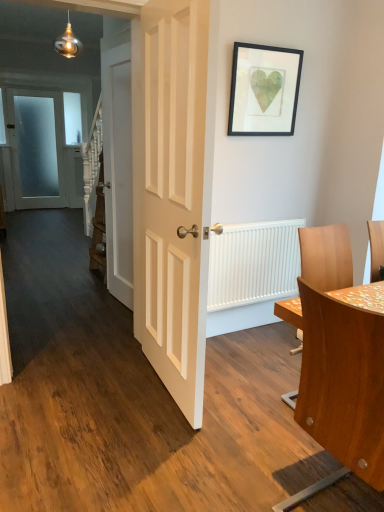
What is the approximate width of black matte picture frame at upper center?

black matte picture frame at upper center is 2.11 inches in width.

The image size is (384, 512). Find the location of `wooden table at right`. wooden table at right is located at coordinates 343,382.

What do you see at coordinates (253, 263) in the screenshot?
I see `white ribbed radiator at right` at bounding box center [253, 263].

Image resolution: width=384 pixels, height=512 pixels. Identify the location of white ribbed radiator at right. (253, 263).

What do you see at coordinates (172, 190) in the screenshot? I see `white glossy door at center, which appears as the 1th door when viewed from the right` at bounding box center [172, 190].

Identify the location of black matte picture frame at upper center. (264, 90).

Is white ribbed radiator at right far away from white glossy door at center, which appears as the 1th door when viewed from the right?

white ribbed radiator at right is near white glossy door at center, which appears as the 1th door when viewed from the right, not far away.

Considering the relative positions of white ribbed radiator at right and white glossy door at center, the third door from the back, in the image provided, is white ribbed radiator at right behind white glossy door at center, the third door from the back,?

Yes, white ribbed radiator at right is further from the camera.

Is point (240, 263) positioned before point (199, 130)?

No, it is not.

At what (x,y) coordinates should I click in order to perform the action: click on door that is the 1st one when counting upward from the white ribbed radiator at right (from the image's perspective). Please return your answer as a coordinate pair (x, y). Looking at the image, I should click on (172, 190).

Is white glossy door at center, the first door when ordered from front to back, to the left of white ribbed radiator at right from the viewer's perspective?

Indeed, white glossy door at center, the first door when ordered from front to back, is positioned on the left side of white ribbed radiator at right.

From the image's perspective, is white glossy door at center, the third door from the back, above or below white ribbed radiator at right?

From the image's perspective, white glossy door at center, the third door from the back, appears above white ribbed radiator at right.

This screenshot has height=512, width=384. Find the location of `radiator directly beneath the white glossy door at center, which appears as the 1th door when viewed from the right (from a real-world perspective)`. radiator directly beneath the white glossy door at center, which appears as the 1th door when viewed from the right (from a real-world perspective) is located at coordinates (253, 263).

Does point (31, 165) come behind point (111, 194)?

Yes, point (31, 165) is farther from viewer.

Who is bigger, frosted glass door at left, marked as the third door in a front-to-back arrangement, or white wooden door at center, which is the second door from front to back?

white wooden door at center, which is the second door from front to back.

Who is bigger, white wooden door at center, which is the second door from front to back, or white ribbed radiator at right?

Result: With larger size is white wooden door at center, which is the second door from front to back.

From the picture: Are white wooden door at center, acting as the 2th door starting from the left, and white ribbed radiator at right far apart?

No, white wooden door at center, acting as the 2th door starting from the left, is in close proximity to white ribbed radiator at right.

Is white wooden door at center, acting as the second door starting from the back, facing towards white ribbed radiator at right?

No, white wooden door at center, acting as the second door starting from the back, is not turned towards white ribbed radiator at right.

Considering the positions of point (106, 116) and point (243, 245), is point (106, 116) closer or farther from the camera than point (243, 245)?

Point (106, 116).

In terms of width, does white glossy door at center, the first door when ordered from front to back, look wider or thinner when compared to frosted glass door at left, the 1th door viewed from the left?

white glossy door at center, the first door when ordered from front to back, is wider than frosted glass door at left, the 1th door viewed from the left.

Is white glossy door at center, which appears as the 1th door when viewed from the right, positioned behind frosted glass door at left, the 1th door viewed from the left?

No, it is not.

Looking at this image, could frosted glass door at left, the 3th door in the right-to-left sequence, be considered to be inside white glossy door at center, which appears as the 1th door when viewed from the right?

No, frosted glass door at left, the 3th door in the right-to-left sequence, is not surrounded by white glossy door at center, which appears as the 1th door when viewed from the right.

Considering the positions of point (154, 358) and point (42, 105), is point (154, 358) closer or farther from the camera than point (42, 105)?

Point (154, 358) appears to be closer to the viewer than point (42, 105).

From a real-world perspective, is white ribbed radiator at right below black matte picture frame at upper center?

Yes, from a real-world perspective, white ribbed radiator at right is under black matte picture frame at upper center.

Looking at this image, considering the positions of objects white ribbed radiator at right and black matte picture frame at upper center in the image provided, who is more to the right, white ribbed radiator at right or black matte picture frame at upper center?

From the viewer's perspective, white ribbed radiator at right appears more on the right side.

Is white ribbed radiator at right aimed at black matte picture frame at upper center?

No, white ribbed radiator at right is not oriented towards black matte picture frame at upper center.

Considering the relative sizes of white ribbed radiator at right and black matte picture frame at upper center in the image provided, is white ribbed radiator at right shorter than black matte picture frame at upper center?

No, white ribbed radiator at right is not shorter than black matte picture frame at upper center.

Which object is closer to the camera taking this photo, black matte picture frame at upper center or white glossy door at center, which appears as the 1th door when viewed from the right?

white glossy door at center, which appears as the 1th door when viewed from the right, is in front.

Is black matte picture frame at upper center smaller than white glossy door at center, the third door from the back?

Indeed, black matte picture frame at upper center has a smaller size compared to white glossy door at center, the third door from the back.

From the image's perspective, which one is positioned higher, black matte picture frame at upper center or white glossy door at center, the first door when ordered from front to back?

black matte picture frame at upper center is shown above in the image.

Where is `the 1st door above the white ribbed radiator at right (from the image's perspective)`? The height and width of the screenshot is (512, 384). the 1st door above the white ribbed radiator at right (from the image's perspective) is located at coordinates (172, 190).

Where is `radiator located on the right of white glossy door at center, which appears as the 1th door when viewed from the right`? radiator located on the right of white glossy door at center, which appears as the 1th door when viewed from the right is located at coordinates (253, 263).

In the scene shown: Looking at the image, which one is located closer to black matte picture frame at upper center, frosted glass door at left, marked as the third door in a front-to-back arrangement, or white wooden door at center, which is the second door from front to back?

white wooden door at center, which is the second door from front to back, is positioned closer to the anchor black matte picture frame at upper center.

Based on their spatial positions, is white glossy door at center, the first door when ordered from front to back, or black matte picture frame at upper center closer to white wooden door at center, arranged as the 2th door when viewed from the right?

Based on the image, white glossy door at center, the first door when ordered from front to back, appears to be nearer to white wooden door at center, arranged as the 2th door when viewed from the right.

Considering their positions, is wooden table at right positioned closer to white wooden door at center, acting as the 2th door starting from the left, than white ribbed radiator at right?

white ribbed radiator at right is closer to white wooden door at center, acting as the 2th door starting from the left.

Considering their positions, is frosted glass door at left, the 1th door viewed from the left, positioned closer to white glossy door at center, the third door from the back, than white ribbed radiator at right?

white ribbed radiator at right is closer to white glossy door at center, the third door from the back.

Estimate the real-world distances between objects in this image. Which object is closer to frosted glass door at left, the 3th door in the right-to-left sequence, white wooden door at center, acting as the second door starting from the back, or white glossy door at center, the first door when ordered from front to back?

The object closer to frosted glass door at left, the 3th door in the right-to-left sequence, is white wooden door at center, acting as the second door starting from the back.

Looking at the image, which one is located closer to white glossy door at center, the first door when ordered from front to back, frosted glass door at left, marked as the third door in a front-to-back arrangement, or black matte picture frame at upper center?

black matte picture frame at upper center lies closer to white glossy door at center, the first door when ordered from front to back, than the other object.

When comparing their distances from black matte picture frame at upper center, does wooden table at right or white ribbed radiator at right seem further?

wooden table at right is further to black matte picture frame at upper center.

Looking at this image, when comparing their distances from white glossy door at center, which appears as the 1th door when viewed from the right, does white ribbed radiator at right or white wooden door at center, acting as the 2th door starting from the left, seem further?

white ribbed radiator at right.

Locate an element on the screen. The width and height of the screenshot is (384, 512). radiator between black matte picture frame at upper center and frosted glass door at left, marked as the third door in a front-to-back arrangement, from front to back is located at coordinates (253, 263).

Identify the location of radiator between black matte picture frame at upper center and wooden table at right vertically. The height and width of the screenshot is (512, 384). click(253, 263).

Locate an element on the screen. This screenshot has width=384, height=512. door between white ribbed radiator at right and frosted glass door at left, which is the 1th door from back to front, in the front-back direction is located at coordinates (118, 166).

Image resolution: width=384 pixels, height=512 pixels. Identify the location of door between white glossy door at center, the first door when ordered from front to back, and frosted glass door at left, the 1th door viewed from the left, in the front-back direction. (118, 166).